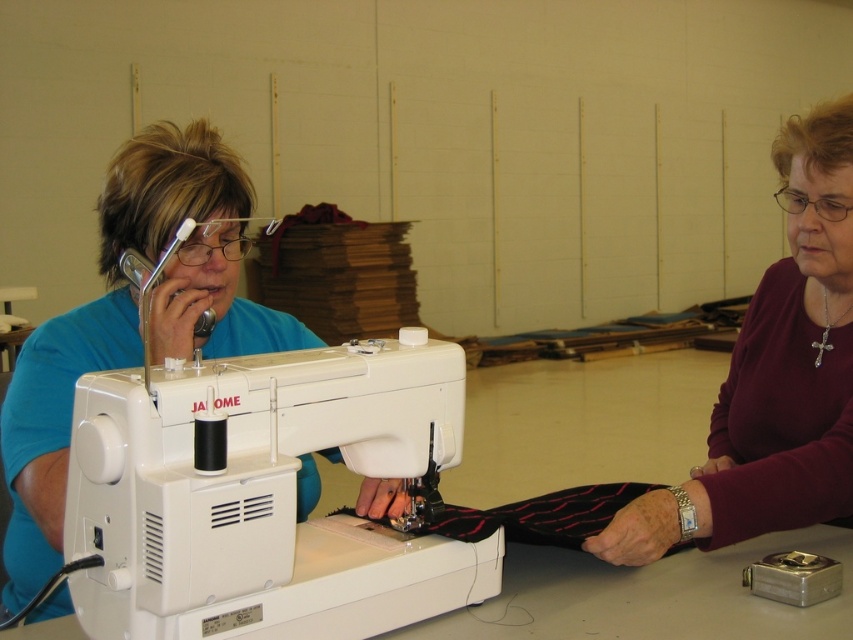
Question: Does white plastic sewing machine at center appear under blue fabric at left?

Choices:
 (A) yes
 (B) no

Answer: (A)

Question: Can you confirm if white plastic sewing machine at center is thinner than blue fabric at left?

Choices:
 (A) yes
 (B) no

Answer: (A)

Question: Which point is farther to the camera?

Choices:
 (A) (349, 563)
 (B) (55, 456)

Answer: (B)

Question: Where is white plastic sewing machine at center located in relation to blue fabric at left in the image?

Choices:
 (A) right
 (B) left

Answer: (A)